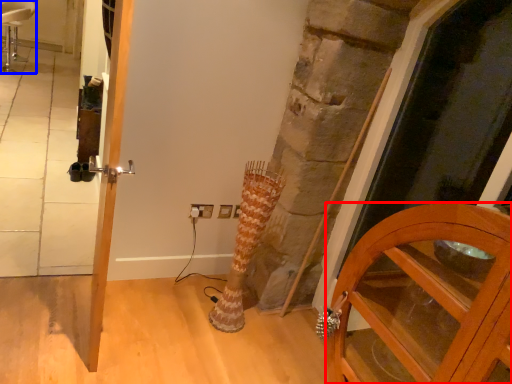
Question: Among these objects, which one is nearest to the camera, cabinetry (highlighted by a red box) or chair (highlighted by a blue box)?

Choices:
 (A) cabinetry
 (B) chair

Answer: (A)